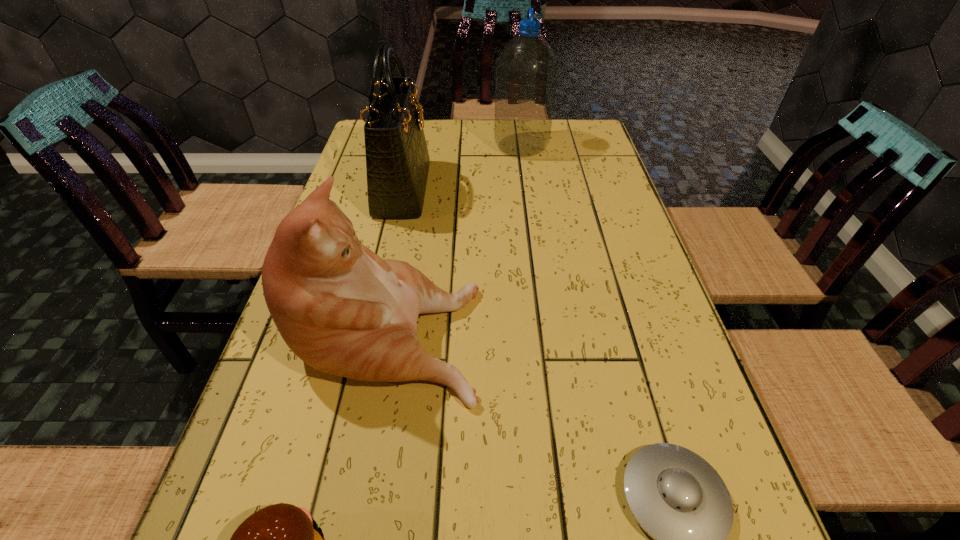
Where is `water jug`? water jug is located at coordinates (526, 69).

You are a GUI agent. You are given a task and a screenshot of the screen. Output one action in this format:
    pyautogui.click(x=<x>, y=<y>)
    Task: Click on the handbag
    This screenshot has width=960, height=540.
    Given the screenshot: What is the action you would take?
    pyautogui.click(x=397, y=160)

At what (x,y) coordinates should I click in order to perform the action: click on the third farthest object. Please return your answer as a coordinate pair (x, y). The width and height of the screenshot is (960, 540). Looking at the image, I should click on (343, 310).

At what (x,y) coordinates should I click in order to perform the action: click on vacant space located 0.110m on the front of the water jug. Please return your answer as a coordinate pair (x, y). The width and height of the screenshot is (960, 540). Looking at the image, I should click on (526, 180).

This screenshot has width=960, height=540. I want to click on vacant space located at the front of the handbag with visible charms, so click(x=506, y=189).

Where is `vacant space located 0.370m on the face of the cat`? The width and height of the screenshot is (960, 540). vacant space located 0.370m on the face of the cat is located at coordinates pos(663,329).

The height and width of the screenshot is (540, 960). I want to click on object located in the far edge section of the desktop, so click(x=526, y=69).

Locate an element on the screen. Image resolution: width=960 pixels, height=540 pixels. handbag located in the left edge section of the desktop is located at coordinates (397, 160).

Identify the location of cat present at the left edge. (343, 310).

The height and width of the screenshot is (540, 960). What are the coordinates of `vacant area at the far edge` in the screenshot? It's located at (483, 153).